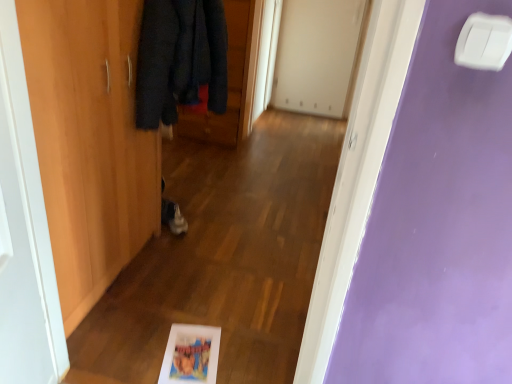
Find the location of `white matte door at upper center, which ranks as the 3th door in left-to-right order`. white matte door at upper center, which ranks as the 3th door in left-to-right order is located at coordinates click(317, 55).

What do you see at coordinates (317, 55) in the screenshot?
I see `white matte door at upper center, the third door viewed from the front` at bounding box center [317, 55].

Consider the image. Measure the distance between dark blue woolen coat at upper left and camera.

The depth of dark blue woolen coat at upper left is 5.27 feet.

What is the approximate width of dark blue woolen coat at upper left?

dark blue woolen coat at upper left is 12.81 inches wide.

The image size is (512, 384). I want to click on white wood door at left, the 2th door positioned from the left, so click(24, 233).

Which of these two, matte plastic picture frame at lower center or white plastic light switch at upper right, stands shorter?

With less height is matte plastic picture frame at lower center.

Who is bigger, matte plastic picture frame at lower center or white plastic light switch at upper right?

matte plastic picture frame at lower center.

From the image's perspective, between matte plastic picture frame at lower center and white plastic light switch at upper right, which one is located above?

white plastic light switch at upper right, from the image's perspective.

From a real-world perspective, is matte plastic picture frame at lower center located beneath white plastic light switch at upper right?

Correct, in the physical world, matte plastic picture frame at lower center is lower than white plastic light switch at upper right.

Would you say dark blue woolen coat at upper left is a long distance from white matte door at upper center, which is the first door in back-to-front order?

Yes, dark blue woolen coat at upper left and white matte door at upper center, which is the first door in back-to-front order, are located far from each other.

Between dark blue woolen coat at upper left and white matte door at upper center, the first door viewed from the right, which one is positioned behind?

white matte door at upper center, the first door viewed from the right.

From a real-world perspective, is dark blue woolen coat at upper left above or below white matte door at upper center, the first door viewed from the right?

dark blue woolen coat at upper left is above white matte door at upper center, the first door viewed from the right.

Is dark blue woolen coat at upper left positioned with its back to white matte door at upper center, which ranks as the 3th door in left-to-right order?

dark blue woolen coat at upper left does not have its back to white matte door at upper center, which ranks as the 3th door in left-to-right order.

Can you tell me how much wooden wardrobe at left, the second door when ordered from back to front, and white matte door at upper center, the first door viewed from the right, differ in facing direction?

They differ by 91.1 degrees in their facing directions.

I want to click on door below the wooden wardrobe at left, acting as the 3th door starting from the right (from a real-world perspective), so click(317, 55).

Consider the image. Considering the relative positions of wooden wardrobe at left, arranged as the 1th door when viewed from the left, and white matte door at upper center, the third door viewed from the front, in the image provided, is wooden wardrobe at left, arranged as the 1th door when viewed from the left, to the left of white matte door at upper center, the third door viewed from the front, from the viewer's perspective?

Yes, wooden wardrobe at left, arranged as the 1th door when viewed from the left, is to the left of white matte door at upper center, the third door viewed from the front.

Does wooden wardrobe at left, acting as the 3th door starting from the right, come in front of white matte door at upper center, which ranks as the 3th door in left-to-right order?

Yes, wooden wardrobe at left, acting as the 3th door starting from the right, is closer to the camera.

Does dark blue woolen coat at upper left touch white wood door at left, which appears as the 1th door when viewed from the front?

No, dark blue woolen coat at upper left is not touching white wood door at left, which appears as the 1th door when viewed from the front.

How far apart are dark blue woolen coat at upper left and white wood door at left, which appears as the 1th door when viewed from the front?

dark blue woolen coat at upper left is 84.08 centimeters away from white wood door at left, which appears as the 1th door when viewed from the front.

Between dark blue woolen coat at upper left and white wood door at left, positioned as the third door in back-to-front order, which one has more height?

With more height is white wood door at left, positioned as the third door in back-to-front order.

Is wooden wardrobe at left, the second door when ordered from back to front, oriented towards white wood door at left, the 2th door from the right?

No, wooden wardrobe at left, the second door when ordered from back to front, is not aimed at white wood door at left, the 2th door from the right.

Identify the location of the 1st door behind the white wood door at left, positioned as the third door in back-to-front order. (89, 142).

Does wooden wardrobe at left, arranged as the 1th door when viewed from the left, lie behind white wood door at left, the 2th door positioned from the left?

Yes.

In the image, is matte plastic picture frame at lower center positioned in front of or behind white matte door at upper center, which ranks as the 3th door in left-to-right order?

Clearly, matte plastic picture frame at lower center is in front of white matte door at upper center, which ranks as the 3th door in left-to-right order.

Where is `picture frame below the white matte door at upper center, the third door viewed from the front (from a real-world perspective)`? picture frame below the white matte door at upper center, the third door viewed from the front (from a real-world perspective) is located at coordinates (191, 355).

Could you measure the distance between matte plastic picture frame at lower center and white matte door at upper center, which is the first door in back-to-front order?

A distance of 3.37 meters exists between matte plastic picture frame at lower center and white matte door at upper center, which is the first door in back-to-front order.

Is point (165, 350) closer to viewer compared to point (291, 109)?

Yes, it is in front of point (291, 109).

Could you tell me if white wood door at left, positioned as the third door in back-to-front order, is turned towards wooden wardrobe at left, the 2th door positioned from the front?

No, white wood door at left, positioned as the third door in back-to-front order, is not aimed at wooden wardrobe at left, the 2th door positioned from the front.

Can you confirm if white wood door at left, the 2th door positioned from the left, is positioned to the left of wooden wardrobe at left, the 2th door positioned from the front?

No, white wood door at left, the 2th door positioned from the left, is not to the left of wooden wardrobe at left, the 2th door positioned from the front.

From the image's perspective, would you say white wood door at left, which appears as the 1th door when viewed from the front, is shown under wooden wardrobe at left, arranged as the 1th door when viewed from the left?

Correct, white wood door at left, which appears as the 1th door when viewed from the front, appears lower than wooden wardrobe at left, arranged as the 1th door when viewed from the left, in the image.

What's the angular difference between white wood door at left, positioned as the third door in back-to-front order, and wooden wardrobe at left, arranged as the 1th door when viewed from the left,'s facing directions?

16.3 degrees.

This screenshot has width=512, height=384. Find the location of `picture frame below the white plastic light switch at upper right (from the image's perspective)`. picture frame below the white plastic light switch at upper right (from the image's perspective) is located at coordinates (191, 355).

At what (x,y) coordinates should I click in order to perform the action: click on door that is on the right side of dark blue woolen coat at upper left. Please return your answer as a coordinate pair (x, y). Image resolution: width=512 pixels, height=384 pixels. Looking at the image, I should click on click(x=317, y=55).

Looking at the image, which one is located further to white plastic light switch at upper right, matte plastic picture frame at lower center or white wood door at left, positioned as the third door in back-to-front order?

Based on the image, matte plastic picture frame at lower center appears to be further to white plastic light switch at upper right.

Estimate the real-world distances between objects in this image. Which object is further from wooden wardrobe at left, arranged as the 1th door when viewed from the left, white wood door at left, positioned as the third door in back-to-front order, or dark blue woolen coat at upper left?

Among the two, white wood door at left, positioned as the third door in back-to-front order, is located further to wooden wardrobe at left, arranged as the 1th door when viewed from the left.

Which object lies nearer to the anchor point white matte door at upper center, the third door viewed from the front, wooden wardrobe at left, the second door when ordered from back to front, or dark blue woolen coat at upper left?

dark blue woolen coat at upper left lies closer to white matte door at upper center, the third door viewed from the front, than the other object.

From the image, which object appears to be nearer to white plastic light switch at upper right, white wood door at left, which appears as the 1th door when viewed from the front, or matte plastic picture frame at lower center?

The object closer to white plastic light switch at upper right is white wood door at left, which appears as the 1th door when viewed from the front.

Looking at this image, considering their positions, is wooden wardrobe at left, the second door when ordered from back to front, positioned closer to white plastic light switch at upper right than white wood door at left, the 2th door positioned from the left?

white wood door at left, the 2th door positioned from the left, is closer to white plastic light switch at upper right.

Based on the photo, looking at the image, which one is located closer to white matte door at upper center, the third door viewed from the front, wooden wardrobe at left, arranged as the 1th door when viewed from the left, or white wood door at left, the 2th door from the right?

Among the two, wooden wardrobe at left, arranged as the 1th door when viewed from the left, is located nearer to white matte door at upper center, the third door viewed from the front.

Considering their positions, is white plastic light switch at upper right positioned closer to wooden wardrobe at left, the second door when ordered from back to front, than dark blue woolen coat at upper left?

The object closer to wooden wardrobe at left, the second door when ordered from back to front, is dark blue woolen coat at upper left.

Looking at the image, which one is located further to wooden wardrobe at left, the 2th door positioned from the front, white wood door at left, the 2th door from the right, or white matte door at upper center, which is the first door in back-to-front order?

Based on the image, white matte door at upper center, which is the first door in back-to-front order, appears to be further to wooden wardrobe at left, the 2th door positioned from the front.

You are a GUI agent. You are given a task and a screenshot of the screen. Output one action in this format:
    pyautogui.click(x=<x>, y=<y>)
    Task: Click on the cloak between white wood door at left, which appears as the 1th door when viewed from the front, and white matte door at upper center, which ranks as the 3th door in left-to-right order, in the front-back direction
    This screenshot has height=384, width=512.
    Given the screenshot: What is the action you would take?
    pyautogui.click(x=180, y=59)

You are a GUI agent. You are given a task and a screenshot of the screen. Output one action in this format:
    pyautogui.click(x=<x>, y=<y>)
    Task: Click on the picture frame between white wood door at left, the 2th door from the right, and white plastic light switch at upper right
    The image size is (512, 384).
    Given the screenshot: What is the action you would take?
    pyautogui.click(x=191, y=355)

The height and width of the screenshot is (384, 512). I want to click on door positioned between white wood door at left, the 2th door from the right, and white matte door at upper center, the first door viewed from the right, from near to far, so click(89, 142).

Image resolution: width=512 pixels, height=384 pixels. I want to click on picture frame between wooden wardrobe at left, the second door when ordered from back to front, and white plastic light switch at upper right, so click(191, 355).